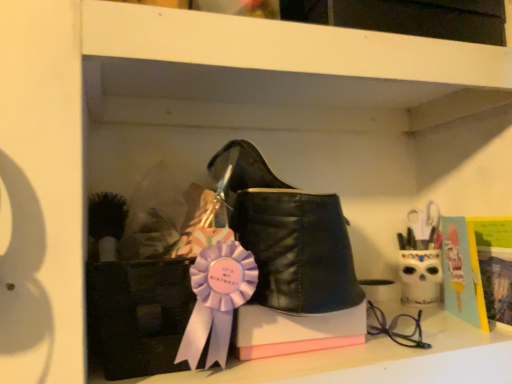
Question: Is matte black glasses at lower right at the back of white matte shelf at upper center?

Choices:
 (A) no
 (B) yes

Answer: (A)

Question: From the image's perspective, does white matte shelf at upper center appear higher than matte black glasses at lower right?

Choices:
 (A) yes
 (B) no

Answer: (A)

Question: Is the position of white matte shelf at upper center more distant than that of matte black glasses at lower right?

Choices:
 (A) no
 (B) yes

Answer: (A)

Question: Is matte black glasses at lower right a part of white matte shelf at upper center?

Choices:
 (A) yes
 (B) no

Answer: (B)

Question: Does white matte shelf at upper center have a larger size compared to matte black glasses at lower right?

Choices:
 (A) yes
 (B) no

Answer: (A)

Question: Does white matte shelf at upper center have a greater height compared to matte black glasses at lower right?

Choices:
 (A) no
 (B) yes

Answer: (B)

Question: Could you tell me if black leather boot at center is turned towards matte black glasses at lower right?

Choices:
 (A) yes
 (B) no

Answer: (B)

Question: Can you confirm if black leather boot at center is positioned to the left of matte black glasses at lower right?

Choices:
 (A) no
 (B) yes

Answer: (B)

Question: From a real-world perspective, is black leather boot at center positioned under matte black glasses at lower right based on gravity?

Choices:
 (A) no
 (B) yes

Answer: (A)

Question: Can you confirm if black leather boot at center is bigger than matte black glasses at lower right?

Choices:
 (A) no
 (B) yes

Answer: (B)

Question: From the image's perspective, does black leather boot at center appear lower than matte black glasses at lower right?

Choices:
 (A) no
 (B) yes

Answer: (A)

Question: Does black leather boot at center lie behind matte black glasses at lower right?

Choices:
 (A) yes
 (B) no

Answer: (B)

Question: From a real-world perspective, is matte black glasses at lower right positioned over black leather boot at center based on gravity?

Choices:
 (A) no
 (B) yes

Answer: (A)